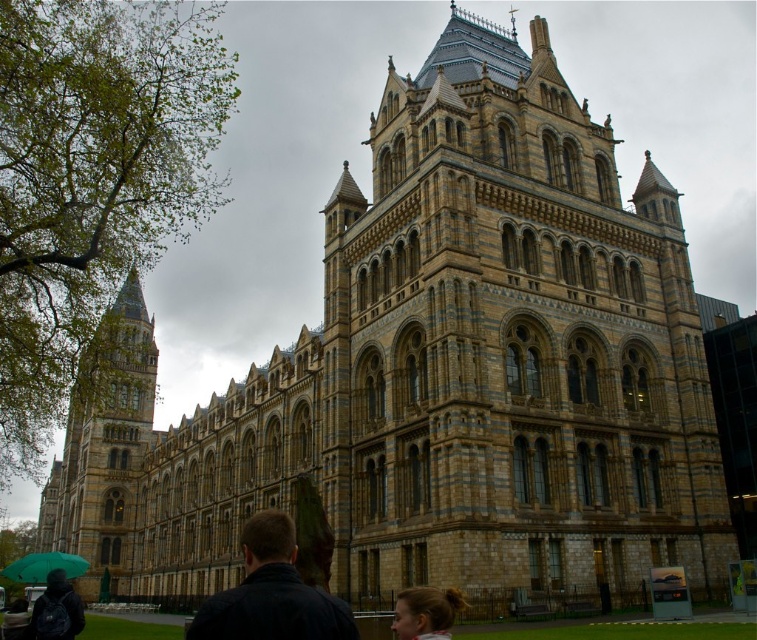
Looking at this image, you are standing at the entrance of the historic building and want to greet the person with the dark blue jacket at lower center. Which direction should you walk to approach them without passing behind the green matte umbrella at lower left?

The dark blue jacket at lower center is in front of the green matte umbrella at lower left, so you should walk towards the lower center direction to approach them without passing behind the umbrella.

You are standing in front of the grand historic building and want to take a photo of the brown stone tower at left. Based on its 2D location coordinates, where should you position yourself to ensure it is centered in your camera frame?

The brown stone tower at left is located at coordinates [104,445], so to center it in your camera frame, position yourself directly facing the point corresponding to those coordinates.